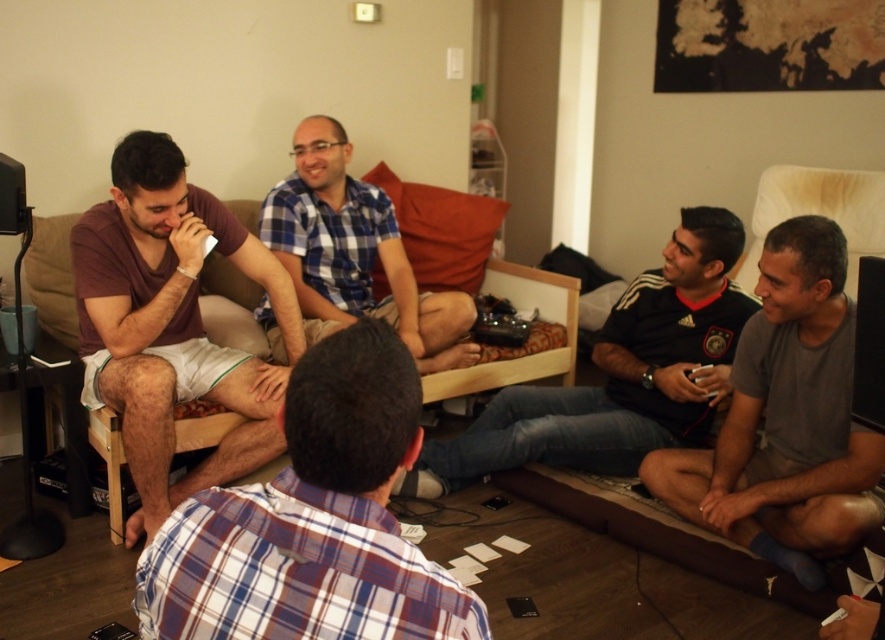
Looking at this image, who is more forward, (x=252, y=467) or (x=233, y=278)?

Point (x=252, y=467)

What do you see at coordinates (170, 323) in the screenshot?
I see `matte brown shorts at left` at bounding box center [170, 323].

Locate an element on the screen. The image size is (885, 640). matte brown shorts at left is located at coordinates (170, 323).

This screenshot has height=640, width=885. Find the location of `matte brown shorts at left`. matte brown shorts at left is located at coordinates (170, 323).

Does point (451, 481) come closer to viewer compared to point (419, 333)?

Yes, it is.

Is dark gray jersey at center to the right of blue plaid shirt at center from the viewer's perspective?

Yes, dark gray jersey at center is to the right of blue plaid shirt at center.

Is point (629, 387) positioned behind point (422, 356)?

No, (629, 387) is in front of (422, 356).

At what (x,y) coordinates should I click in order to perform the action: click on dark gray jersey at center. Please return your answer as a coordinate pair (x, y). This screenshot has width=885, height=640. Looking at the image, I should click on (620, 374).

Who is more forward, (766, 340) or (556, 356)?

Point (766, 340) is more forward.

Find the location of a particular element. The image size is (885, 640). gray cotton shirt at lower right is located at coordinates (786, 419).

Where is `gray cotton shirt at lower right`? gray cotton shirt at lower right is located at coordinates (786, 419).

You are a GUI agent. You are given a task and a screenshot of the screen. Output one action in this format:
    pyautogui.click(x=<x>, y=<y>)
    Task: Click on the gray cotton shirt at lower right
    
    Given the screenshot: What is the action you would take?
    pyautogui.click(x=786, y=419)